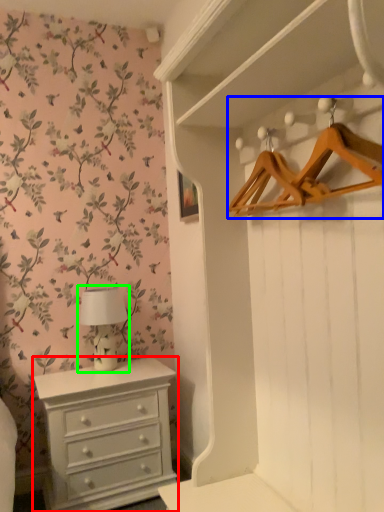
Question: Which object is positioned farthest from chest of drawers (highlighted by a red box)? Select from hanger (highlighted by a blue box) and table lamp (highlighted by a green box).

Choices:
 (A) hanger
 (B) table lamp

Answer: (A)